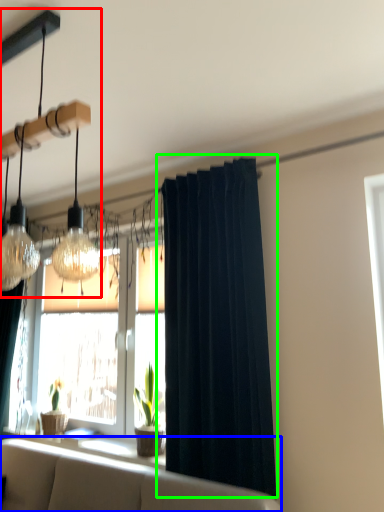
Question: Which object is positioned closest to lamp (highlighted by a red box)? Select from studio couch (highlighted by a blue box) and curtain (highlighted by a green box).

Choices:
 (A) studio couch
 (B) curtain

Answer: (B)